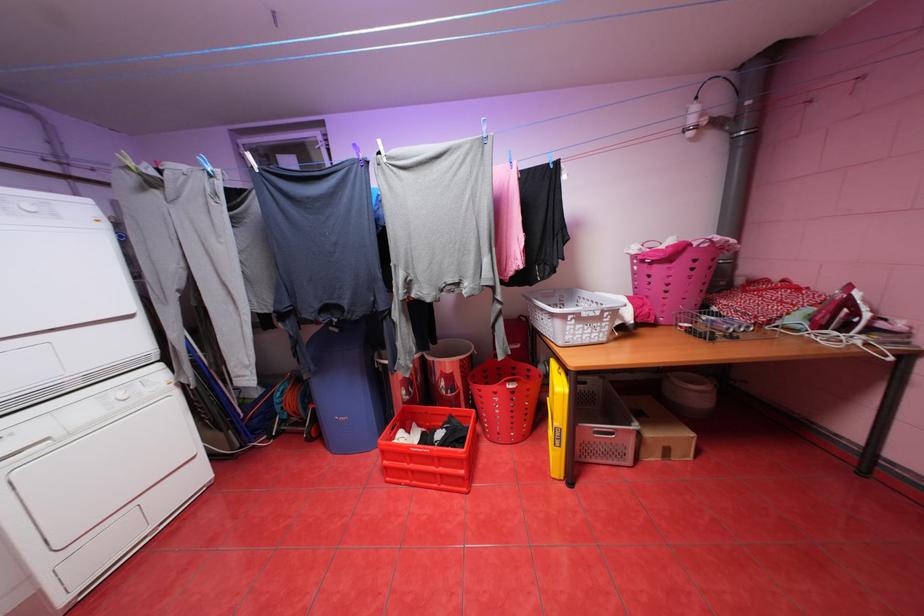
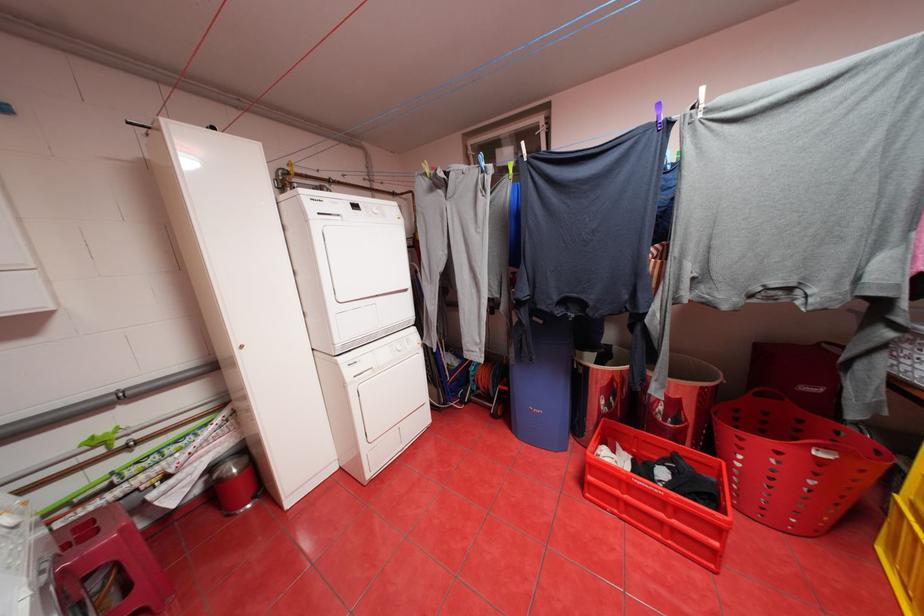
Find the pixel in the second image that matches (517,386) in the first image.

(828, 453)